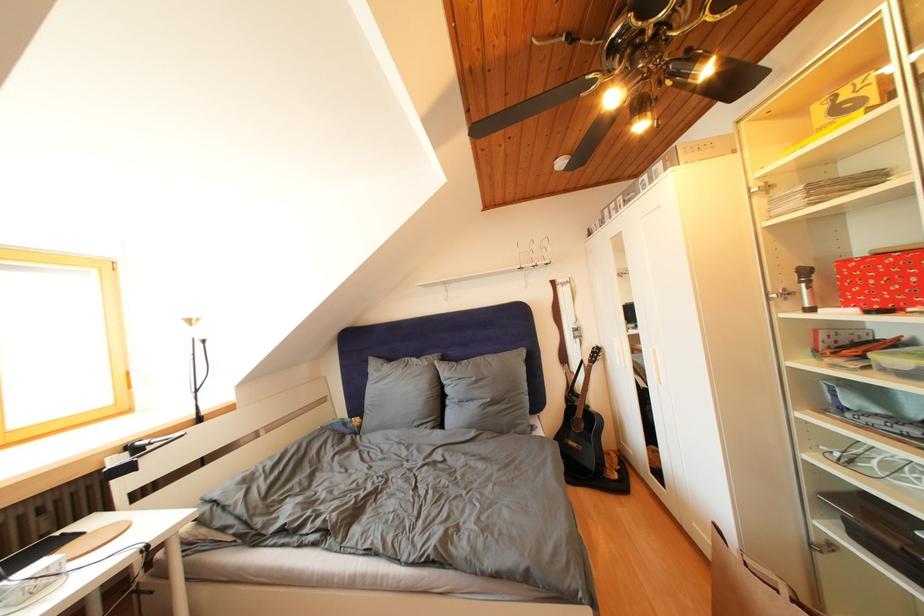
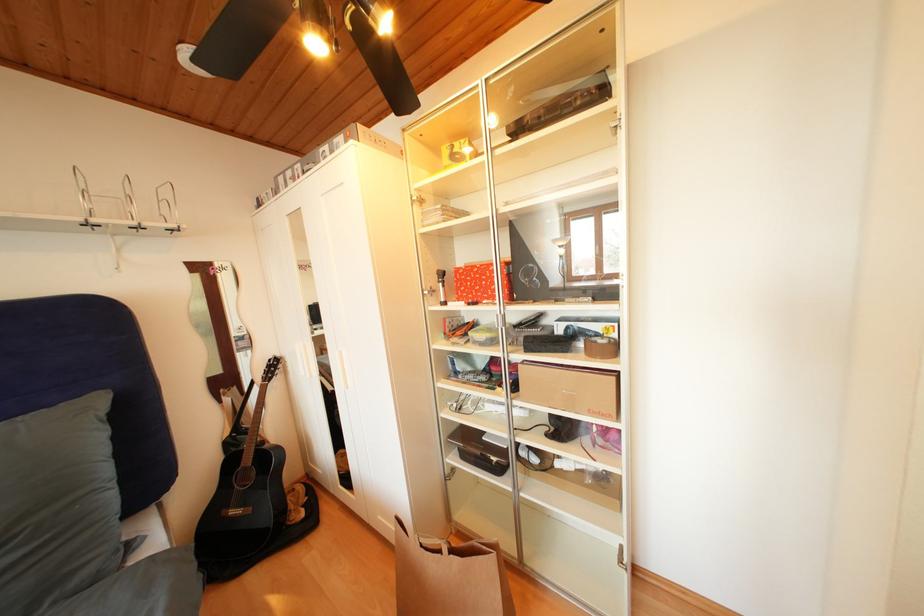
Question: The camera is either moving clockwise (left) or counter-clockwise (right) around the object. The first image is from the beginning of the video and the second image is from the end. Is the camera moving left or right when shooting the video?

Choices:
 (A) Left
 (B) Right

Answer: (A)